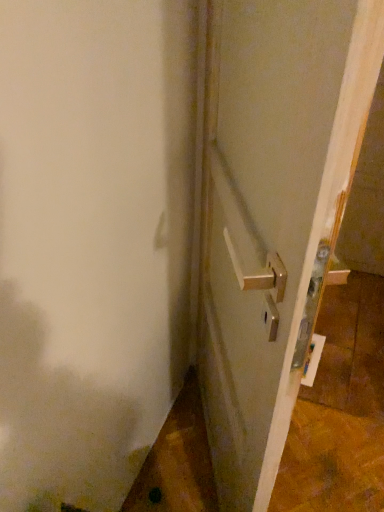
The image size is (384, 512). What do you see at coordinates (273, 212) in the screenshot?
I see `metallic silver handle at center` at bounding box center [273, 212].

In order to click on metallic silver handle at center in this screenshot , I will do `click(273, 212)`.

What is the approximate height of metallic silver handle at center?

metallic silver handle at center is 1.35 meters tall.

Where is `metallic silver handle at center`? This screenshot has width=384, height=512. metallic silver handle at center is located at coordinates (273, 212).